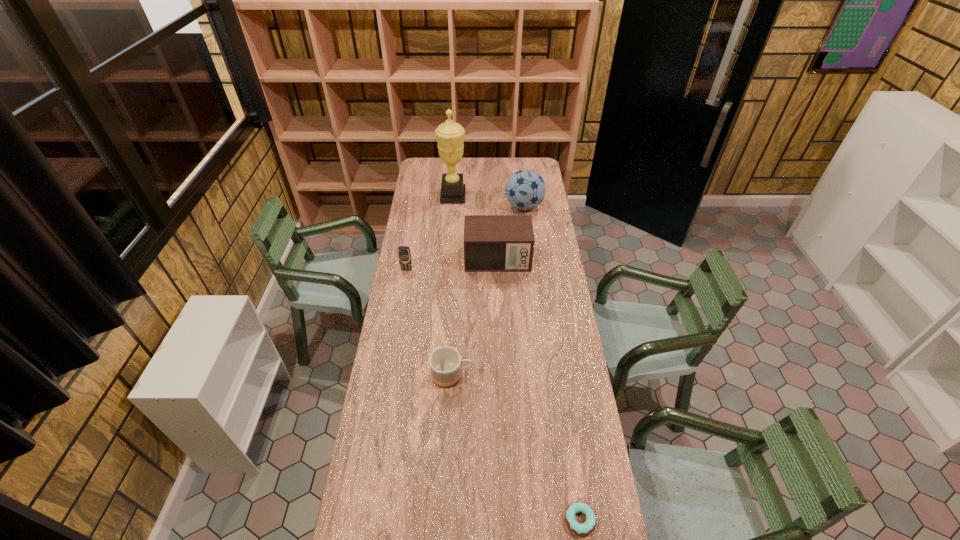
Identify the location of the tallest object. (450, 135).

You are a GUI agent. You are given a task and a screenshot of the screen. Output one action in this format:
    pyautogui.click(x=<x>, y=<y>)
    Task: Click on the soccer ball
    This screenshot has width=960, height=540.
    Given the screenshot: What is the action you would take?
    pyautogui.click(x=525, y=189)

Locate an element on the screen. The image size is (960, 540). radio receiver is located at coordinates (492, 243).

Locate an element on the screen. The height and width of the screenshot is (540, 960). cellular telephone is located at coordinates (404, 255).

Where is `the third shortest object`? This screenshot has height=540, width=960. the third shortest object is located at coordinates click(x=404, y=255).

You are a GUI agent. You are given a task and a screenshot of the screen. Output one action in this format:
    pyautogui.click(x=<x>, y=<y>)
    Task: Click on the mug
    The height and width of the screenshot is (540, 960).
    Given the screenshot: What is the action you would take?
    pyautogui.click(x=445, y=362)

Locate an element on the screen. the fifth farthest object is located at coordinates (x=445, y=362).

Locate an element on the screen. the nearest object is located at coordinates (586, 528).

This screenshot has height=540, width=960. What are the coordinates of `doughnut` in the screenshot? It's located at (586, 528).

Image resolution: width=960 pixels, height=540 pixels. I want to click on vacant space located 0.390m at the front of the tallest object with handles, so click(533, 196).